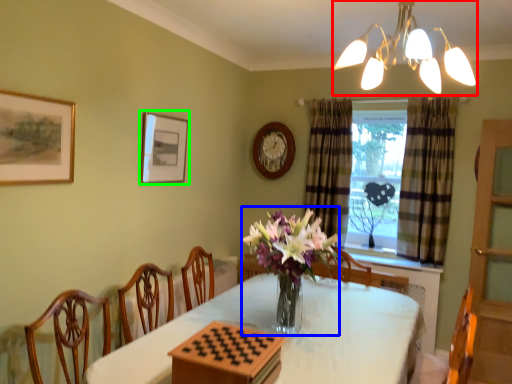
Question: Based on their relative distances, which object is farther from lamp (highlighted by a red box)? Choose from floral arrangement (highlighted by a blue box) and picture frame (highlighted by a green box).

Choices:
 (A) floral arrangement
 (B) picture frame

Answer: (B)